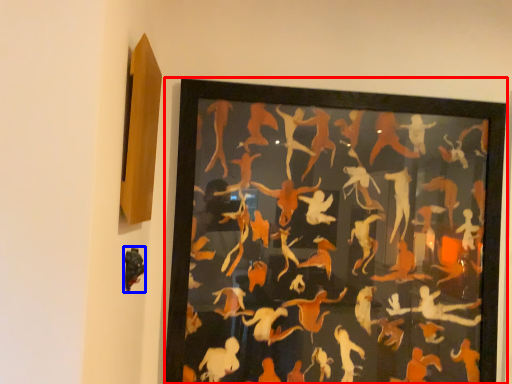
Question: Which of the following is the closest to the observer, picture frame (highlighted by a red box) or animal (highlighted by a blue box)?

Choices:
 (A) picture frame
 (B) animal

Answer: (B)